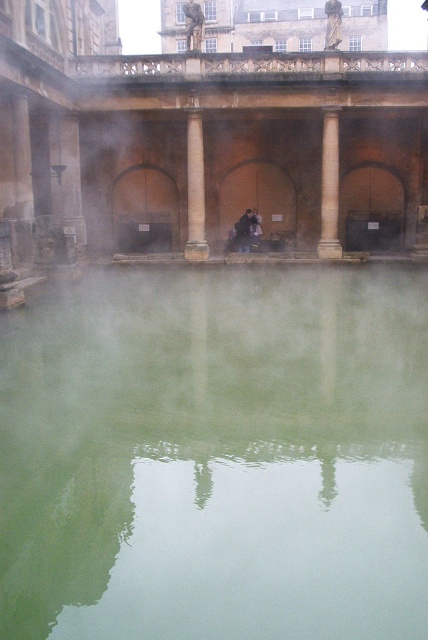
Consider the image. Between green reflective water at center and dark brown leather jacket at center, which one has less height?

dark brown leather jacket at center is shorter.

Is point (345, 292) in front of point (247, 218)?

That is True.

Locate an element on the screen. Image resolution: width=428 pixels, height=640 pixels. green reflective water at center is located at coordinates (216, 456).

Between brown stone column at center and dark brown leather jacket at center, which one has more height?

Standing taller between the two is dark brown leather jacket at center.

Is point (192, 230) less distant than point (250, 211)?

That is True.

You are a GUI agent. You are given a task and a screenshot of the screen. Output one action in this format:
    pyautogui.click(x=<x>, y=<y>)
    Task: Click on the brown stone column at center
    
    Given the screenshot: What is the action you would take?
    pyautogui.click(x=195, y=189)

Does smooth stone column at center have a lesser width compared to brown stone column at center?

Incorrect, smooth stone column at center's width is not less than brown stone column at center's.

At what (x,y) coordinates should I click in order to perform the action: click on smooth stone column at center. Please return your answer as a coordinate pair (x, y). The image size is (428, 640). Looking at the image, I should click on (329, 188).

Locate an element on the screen. smooth stone column at center is located at coordinates (329, 188).